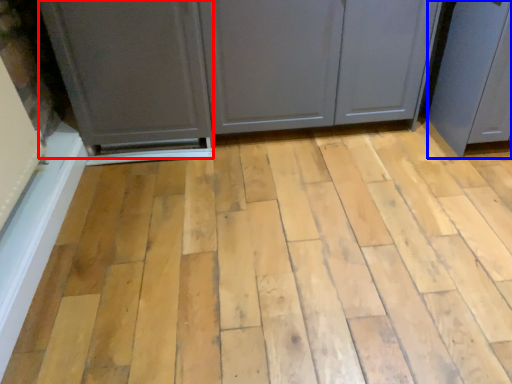
Question: Which object appears farthest to the camera in this image, screen door (highlighted by a red box) or screen door (highlighted by a blue box)?

Choices:
 (A) screen door
 (B) screen door

Answer: (A)